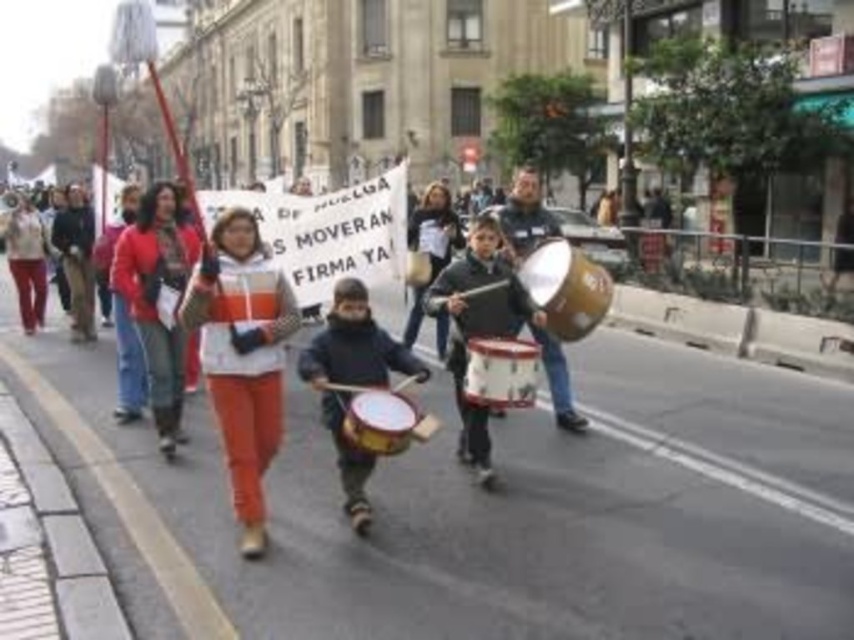
Does wooden drums at center appear over dark brown leather jacket at center?

Correct, wooden drums at center is located above dark brown leather jacket at center.

Which is in front, point (320, 276) or point (69, 236)?

Point (320, 276)

Is point (281, 211) closer to camera compared to point (75, 332)?

Yes, point (281, 211) is closer to viewer.

Identify the location of wooden drums at center. This screenshot has height=640, width=854. (334, 237).

Can you confirm if matte red jacket at center is positioned above dark brown leather jacket at center?

No, matte red jacket at center is not above dark brown leather jacket at center.

Can you confirm if matte red jacket at center is bigger than dark brown leather jacket at center?

Correct, matte red jacket at center is larger in size than dark brown leather jacket at center.

Where is `matte red jacket at center`? The height and width of the screenshot is (640, 854). matte red jacket at center is located at coordinates (156, 300).

Locate an element on the screen. matte red jacket at center is located at coordinates (156, 300).

Is matte black drum at center to the left of orange cotton pants at center from the viewer's perspective?

Incorrect, matte black drum at center is not on the left side of orange cotton pants at center.

Who is more distant from viewer, (352,349) or (34,269)?

Point (34,269)

Find the location of `matte black drum at center`. matte black drum at center is located at coordinates (354, 381).